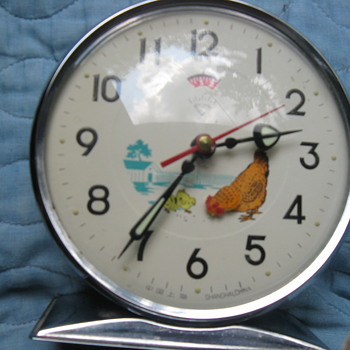
The width and height of the screenshot is (350, 350). I want to click on silver clock stand, so click(x=134, y=335).